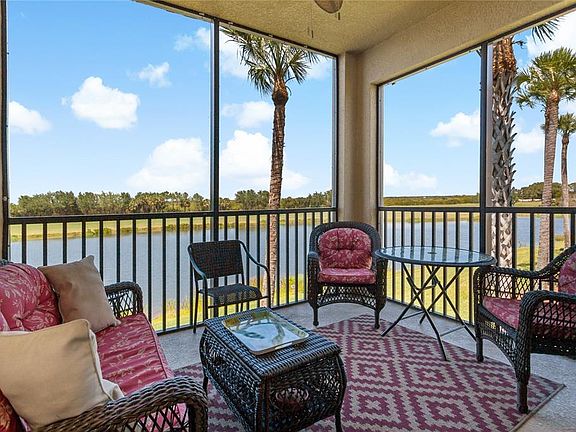
Identify the location of cushion. (504, 307), (572, 273), (344, 272), (344, 253), (137, 347), (18, 301), (2, 325).